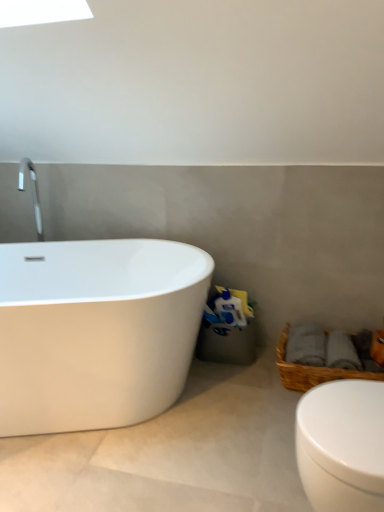
Question: Is white glossy toilet at lower right at the back of woven brown basket at lower right?

Choices:
 (A) no
 (B) yes

Answer: (A)

Question: Does woven brown basket at lower right turn towards white glossy toilet at lower right?

Choices:
 (A) yes
 (B) no

Answer: (B)

Question: Can you confirm if woven brown basket at lower right is taller than white glossy toilet at lower right?

Choices:
 (A) yes
 (B) no

Answer: (B)

Question: Is woven brown basket at lower right shorter than white glossy toilet at lower right?

Choices:
 (A) no
 (B) yes

Answer: (B)

Question: Considering the relative sizes of woven brown basket at lower right and white glossy toilet at lower right in the image provided, is woven brown basket at lower right wider than white glossy toilet at lower right?

Choices:
 (A) no
 (B) yes

Answer: (B)

Question: Is woven brown basket at lower right surrounding white glossy toilet at lower right?

Choices:
 (A) yes
 (B) no

Answer: (B)

Question: Does white glossy bathtub at left have a smaller size compared to white glossy toilet at lower right?

Choices:
 (A) yes
 (B) no

Answer: (B)

Question: From a real-world perspective, is white glossy bathtub at left over white glossy toilet at lower right?

Choices:
 (A) no
 (B) yes

Answer: (B)

Question: Would you say white glossy bathtub at left is a long distance from white glossy toilet at lower right?

Choices:
 (A) no
 (B) yes

Answer: (A)

Question: Is white glossy bathtub at left oriented towards white glossy toilet at lower right?

Choices:
 (A) no
 (B) yes

Answer: (B)

Question: Is white glossy toilet at lower right at the back of white glossy bathtub at left?

Choices:
 (A) yes
 (B) no

Answer: (B)

Question: Is white glossy bathtub at left to the right of white glossy toilet at lower right from the viewer's perspective?

Choices:
 (A) yes
 (B) no

Answer: (B)

Question: From the image's perspective, is white glossy toilet at lower right located above woven brown basket at lower right?

Choices:
 (A) yes
 (B) no

Answer: (B)